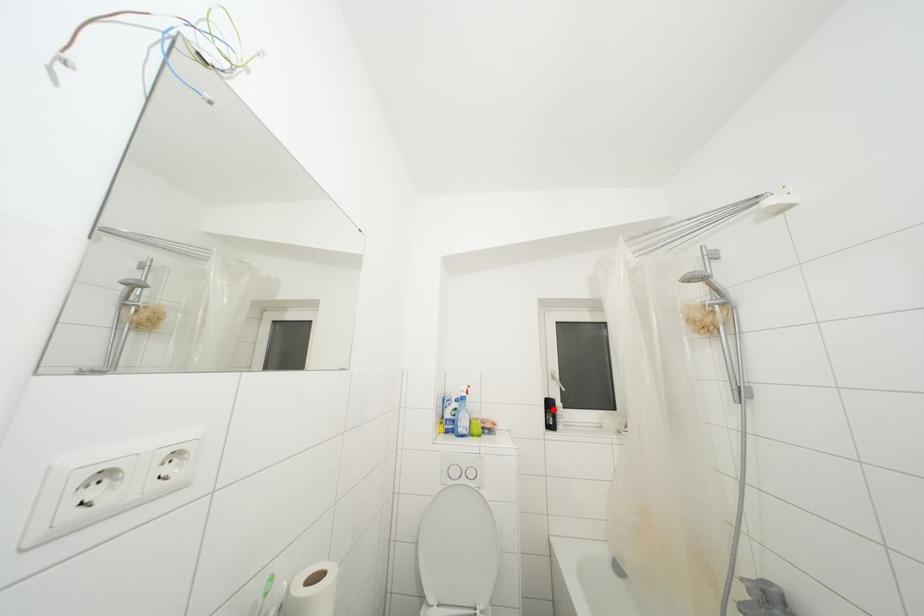
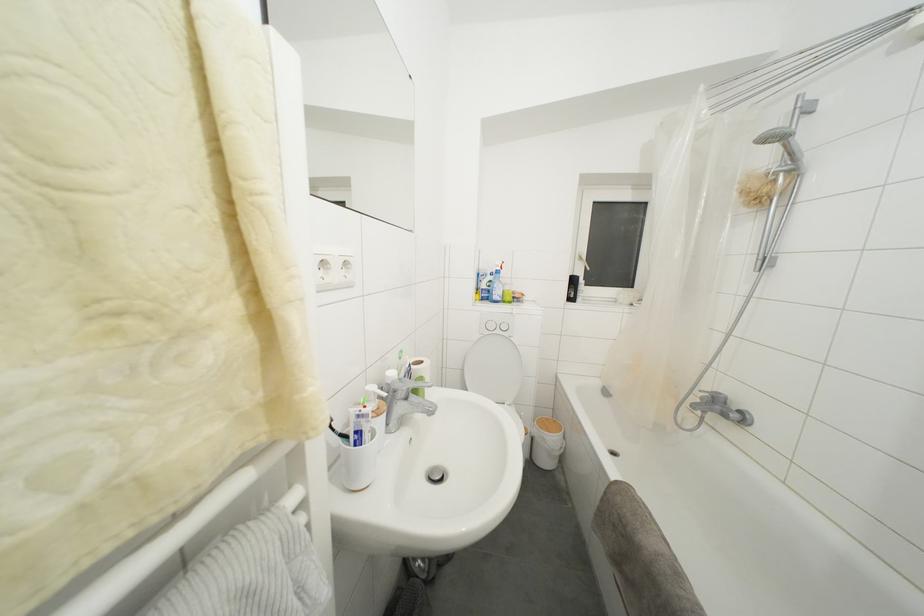
Question: A red point is marked in image1. In image2, is the corresponding 3D point closer to the camera or farther? Reply with the corresponding letter.

Choices:
 (A) The corresponding 3D point is closer.
 (B) The corresponding 3D point is farther.

Answer: (A)